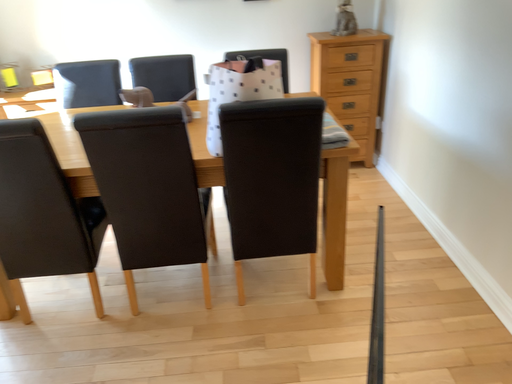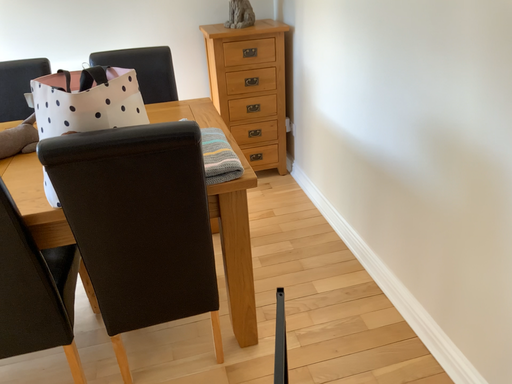
Question: How did the camera likely rotate when shooting the video?

Choices:
 (A) rotated left
 (B) rotated right

Answer: (B)